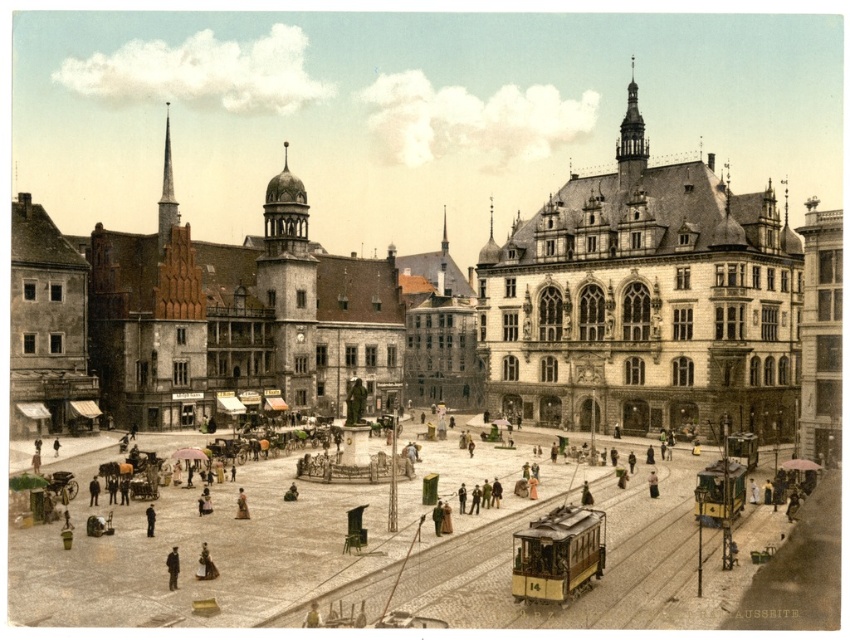
Is stone building at center positioned in front of dark gray suit at lower left?

No.

Does stone building at center have a greater width compared to dark gray suit at lower left?

Yes.

Describe the element at coordinates (428, 312) in the screenshot. The width and height of the screenshot is (850, 640). I see `stone building at center` at that location.

Locate an element on the screen. stone building at center is located at coordinates (428, 312).

Can you confirm if smooth beige hat at lower center is positioned above brown leather jacket at center?

Incorrect, smooth beige hat at lower center is not positioned above brown leather jacket at center.

Measure the distance between smooth beige hat at lower center and brown leather jacket at center.

smooth beige hat at lower center and brown leather jacket at center are 34.81 feet apart from each other.

Does point (204, 545) come closer to viewer compared to point (245, 502)?

Yes.

Where is `smooth beige hat at lower center`? This screenshot has width=850, height=640. smooth beige hat at lower center is located at coordinates (207, 563).

Who is shorter, brown leather jacket at center or light brown leather jacket at center?

light brown leather jacket at center

Measure the distance between brown leather jacket at center and camera.

209.66 feet

Locate an element on the screen. The height and width of the screenshot is (640, 850). brown leather jacket at center is located at coordinates point(241,506).